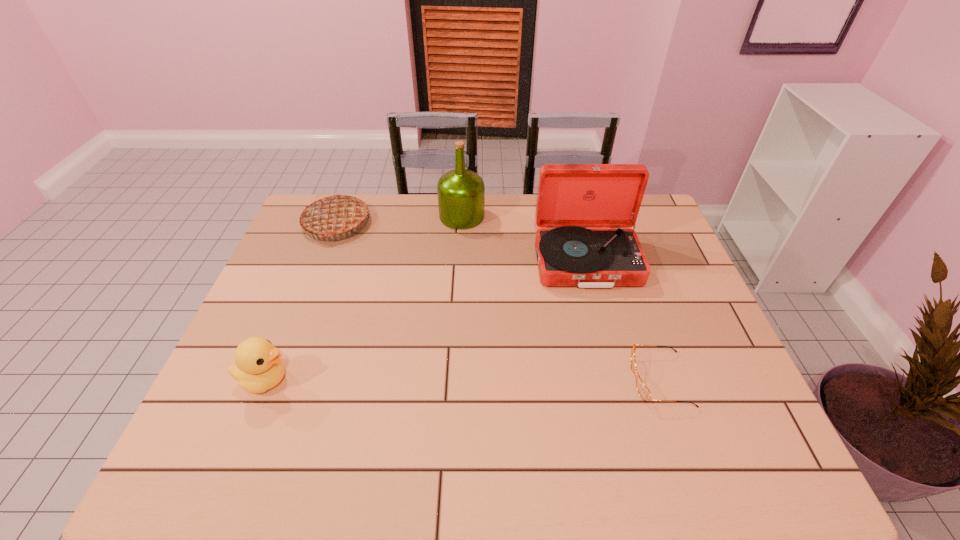
This screenshot has width=960, height=540. I want to click on free space at the near edge of the desktop, so click(x=424, y=450).

Where is `vacant space at the left edge of the desktop`? This screenshot has width=960, height=540. vacant space at the left edge of the desktop is located at coordinates (229, 378).

Locate an element on the screen. free space at the right edge of the desktop is located at coordinates (750, 404).

Identify the location of free region at the near left corner of the desktop. (259, 460).

In the image, there is a desktop. In order to click on free space at the near right corner in this screenshot , I will do click(x=705, y=459).

Where is `empty space that is in between the second shortest object and the phonograph_record`? This screenshot has width=960, height=540. empty space that is in between the second shortest object and the phonograph_record is located at coordinates (425, 321).

This screenshot has width=960, height=540. In order to click on vacant area between the duck and the shortest object in this screenshot , I will do `click(463, 380)`.

Locate an element on the screen. The height and width of the screenshot is (540, 960). free space between the third object from right to left and the phonograph_record is located at coordinates (524, 239).

This screenshot has height=540, width=960. What are the coordinates of `free point between the third shortest object and the duck` in the screenshot? It's located at (300, 301).

This screenshot has height=540, width=960. I want to click on vacant area that lies between the fourth tallest object and the shortest object, so click(463, 380).